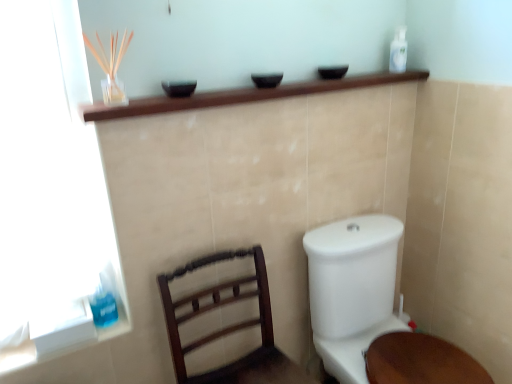
Question: From the image's perspective, is dark wood chair at lower left under white glossy toilet at lower right?

Choices:
 (A) yes
 (B) no

Answer: (A)

Question: Considering the relative sizes of dark wood chair at lower left and white glossy toilet at lower right in the image provided, is dark wood chair at lower left wider than white glossy toilet at lower right?

Choices:
 (A) no
 (B) yes

Answer: (A)

Question: Is dark wood chair at lower left touching white glossy toilet at lower right?

Choices:
 (A) no
 (B) yes

Answer: (A)

Question: Can you confirm if dark wood chair at lower left is smaller than white glossy toilet at lower right?

Choices:
 (A) yes
 (B) no

Answer: (A)

Question: From a real-world perspective, is dark wood chair at lower left on white glossy toilet at lower right?

Choices:
 (A) yes
 (B) no

Answer: (A)

Question: Can you confirm if dark wood chair at lower left is positioned to the right of white glossy toilet at lower right?

Choices:
 (A) yes
 (B) no

Answer: (B)

Question: Can you confirm if white plastic bottle at upper right, which appears as the 1th toiletry when viewed from the right, is positioned to the left of blue translucent liquid at lower left, the 2th toiletry viewed from the back?

Choices:
 (A) no
 (B) yes

Answer: (A)

Question: Is white plastic bottle at upper right, the second toiletry ordered from the bottom, bigger than blue translucent liquid at lower left, the 2th toiletry viewed from the back?

Choices:
 (A) no
 (B) yes

Answer: (B)

Question: Is blue translucent liquid at lower left, the 2th toiletry viewed from the back, surrounded by white plastic bottle at upper right, which appears as the 1th toiletry when viewed from the right?

Choices:
 (A) yes
 (B) no

Answer: (B)

Question: Can you confirm if white plastic bottle at upper right, which appears as the 1th toiletry when viewed from the right, is thinner than blue translucent liquid at lower left, which is the 1th toiletry in bottom-to-top order?

Choices:
 (A) no
 (B) yes

Answer: (A)

Question: Is white plastic bottle at upper right, which is the first toiletry from back to front, turned away from blue translucent liquid at lower left, which is the 1th toiletry in bottom-to-top order?

Choices:
 (A) yes
 (B) no

Answer: (B)

Question: From the image's perspective, is white plastic bottle at upper right, which is the first toiletry from back to front, over blue translucent liquid at lower left, placed as the 1th toiletry when sorted from left to right?

Choices:
 (A) yes
 (B) no

Answer: (A)

Question: Considering the relative sizes of dark wood chair at lower left and white plastic bottle at upper right, the second toiletry from the left, in the image provided, is dark wood chair at lower left bigger than white plastic bottle at upper right, the second toiletry from the left,?

Choices:
 (A) no
 (B) yes

Answer: (B)